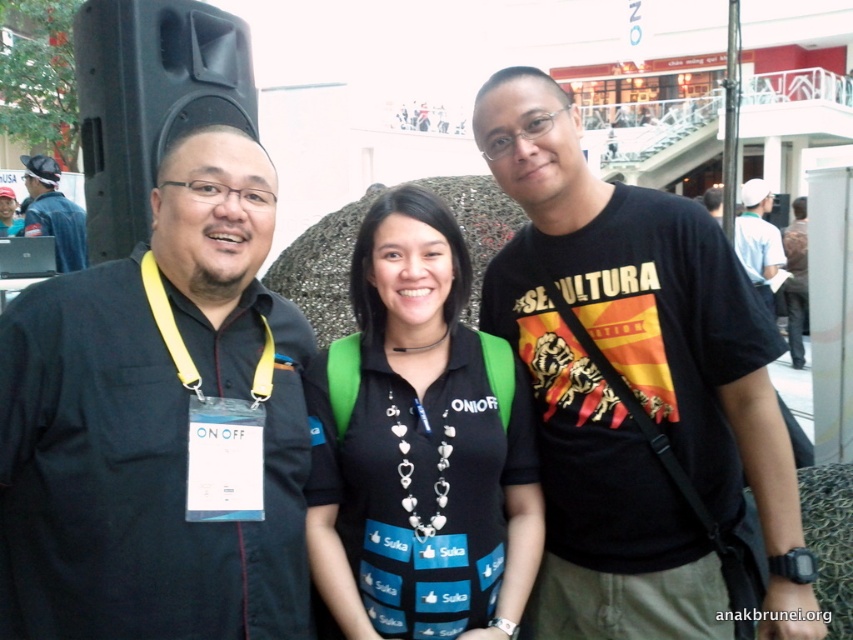
Between black cotton t-shirt at center and dark blue shirt at left, which one is positioned lower?

Positioned lower is black cotton t-shirt at center.

Where is `black cotton t-shirt at center`? black cotton t-shirt at center is located at coordinates (636, 392).

Measure the distance between black matte shirt at left and dark blue shirt at left.

38.91 feet

Is black matte shirt at left positioned before dark blue shirt at left?

Yes, it is.

This screenshot has height=640, width=853. What do you see at coordinates (160, 426) in the screenshot?
I see `black matte shirt at left` at bounding box center [160, 426].

You are a GUI agent. You are given a task and a screenshot of the screen. Output one action in this format:
    pyautogui.click(x=<x>, y=<y>)
    Task: Click on the black matte shirt at left
    
    Given the screenshot: What is the action you would take?
    pyautogui.click(x=160, y=426)

Is black matte shirt at left wider than yellow fabric lanyard at center?

Yes, black matte shirt at left is wider than yellow fabric lanyard at center.

Who is more forward, [273,461] or [393,353]?

Point [273,461]

The width and height of the screenshot is (853, 640). Identify the location of black matte shirt at left. (160, 426).